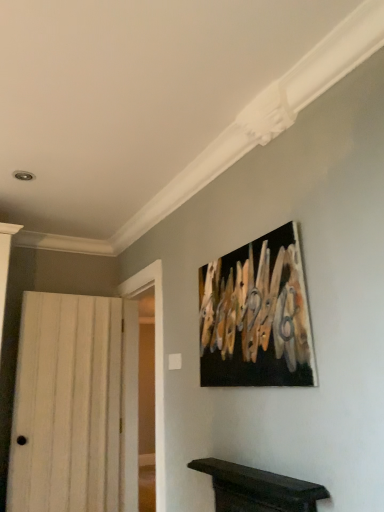
Question: Considering the relative positions of black canvas painting at upper center and white wood door at left in the image provided, is black canvas painting at upper center to the left or to the right of white wood door at left?

Choices:
 (A) right
 (B) left

Answer: (A)

Question: From the image's perspective, is black canvas painting at upper center positioned above or below white wood door at left?

Choices:
 (A) below
 (B) above

Answer: (B)

Question: Is point (279, 348) closer or farther from the camera than point (64, 428)?

Choices:
 (A) closer
 (B) farther

Answer: (A)

Question: Is white wood door at left in front of or behind black canvas painting at upper center in the image?

Choices:
 (A) behind
 (B) front

Answer: (A)

Question: Considering the positions of white wood door at left and black canvas painting at upper center in the image, is white wood door at left wider or thinner than black canvas painting at upper center?

Choices:
 (A) wide
 (B) thin

Answer: (A)

Question: Considering the positions of white wood door at left and black canvas painting at upper center in the image, is white wood door at left taller or shorter than black canvas painting at upper center?

Choices:
 (A) short
 (B) tall

Answer: (B)

Question: Visually, is white wood door at left positioned to the left or to the right of black canvas painting at upper center?

Choices:
 (A) right
 (B) left

Answer: (B)